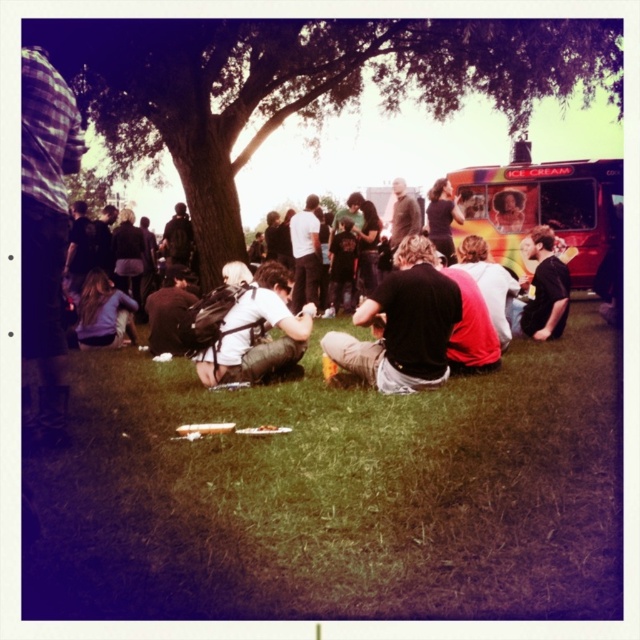
Which is more to the left, black cotton shirt at center or red shirt at center?

black cotton shirt at center

Which of these two, black cotton shirt at center or red shirt at center, stands taller?

Standing taller between the two is black cotton shirt at center.

Locate an element on the screen. Image resolution: width=640 pixels, height=640 pixels. black cotton shirt at center is located at coordinates click(x=403, y=324).

Is black cotton shirt at center bigger than black t-shirt at lower right?

No.

Can you confirm if black cotton shirt at center is thinner than black t-shirt at lower right?

In fact, black cotton shirt at center might be wider than black t-shirt at lower right.

Between point (406, 349) and point (541, 304), which one is positioned in front?

Point (406, 349) is more forward.

You are a GUI agent. You are given a task and a screenshot of the screen. Output one action in this format:
    pyautogui.click(x=<x>, y=<y>)
    Task: Click on the black cotton shirt at center
    
    Given the screenshot: What is the action you would take?
    pyautogui.click(x=403, y=324)

Does black t-shirt at lower right appear over red shirt at center?

Yes.

Who is more distant from viewer, (547,240) or (492,317)?

Positioned behind is point (547,240).

Does point (522, 332) lie in front of point (499, 316)?

No, it is behind (499, 316).

Locate an element on the screen. This screenshot has width=640, height=640. black t-shirt at lower right is located at coordinates (541, 291).